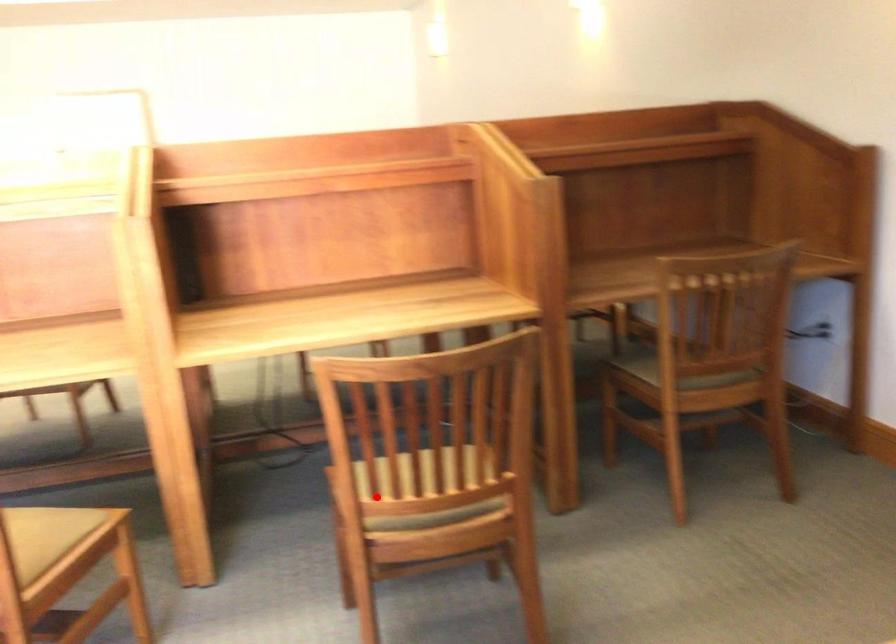
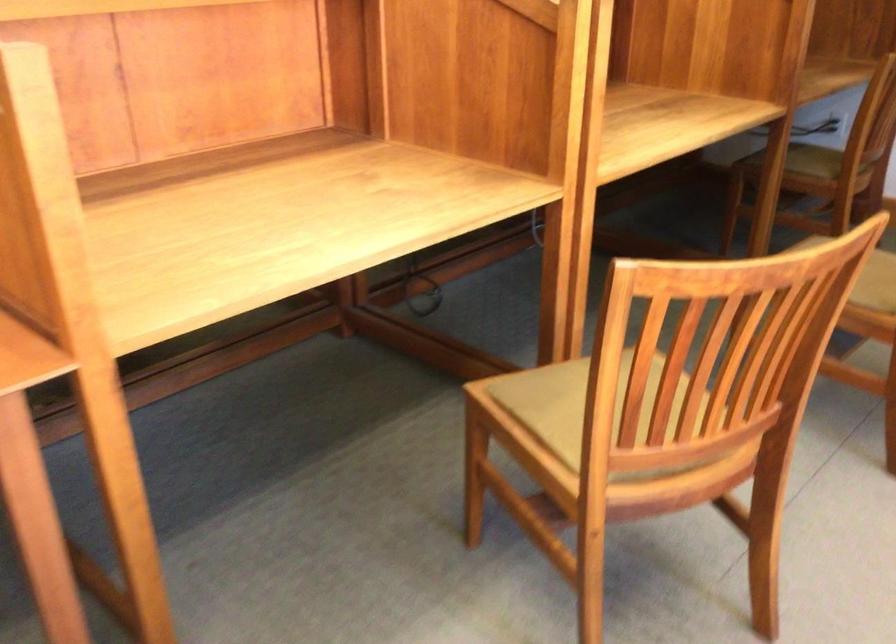
Locate, in the second image, the point that corresponds to the highlighted location in the first image.

(869, 275)